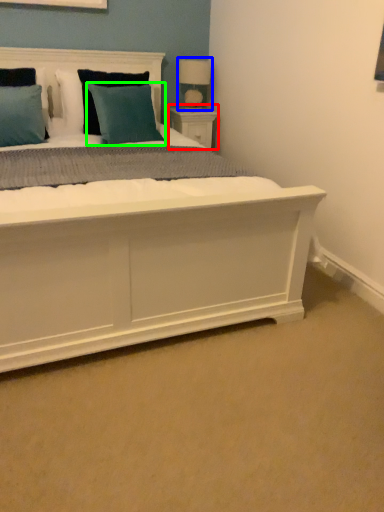
Question: Estimate the real-world distances between objects in this image. Which object is farther from nightstand (highlighted by a red box), table lamp (highlighted by a blue box) or pillow (highlighted by a green box)?

Choices:
 (A) table lamp
 (B) pillow

Answer: (B)